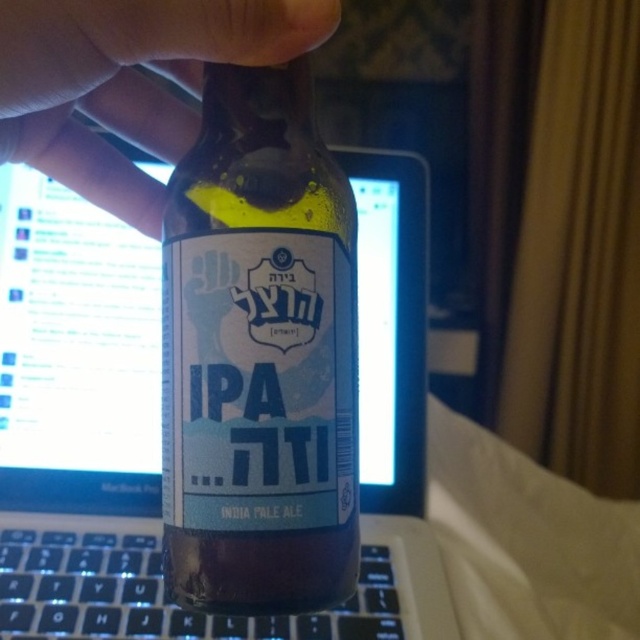
Looking at this image, does glossy plastic computer screen at center come in front of matte skin at upper left?

No, it is not.

Locate an element on the screen. glossy plastic computer screen at center is located at coordinates (76, 356).

In the scene shown: Can you confirm if glossy plastic computer screen at center is positioned above black plastic keyboard at lower left?

Yes.

Between point (42, 228) and point (42, 561), which one is positioned in front?

Positioned in front is point (42, 561).

This screenshot has height=640, width=640. I want to click on glossy plastic computer screen at center, so click(76, 356).

Between point (205, 600) and point (160, 100), which one is positioned behind?

The point (160, 100) is more distant.

Where is `clear glass ipa at center`? The width and height of the screenshot is (640, 640). clear glass ipa at center is located at coordinates (259, 355).